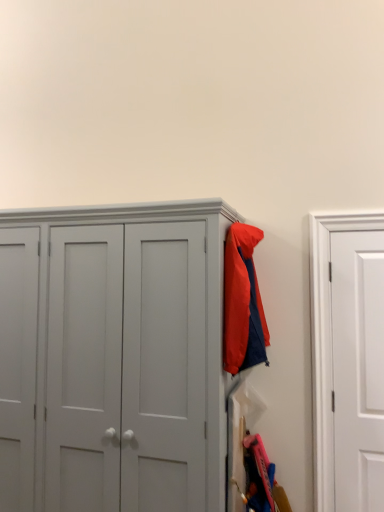
Question: Considering the positions of matte gray cupboard at center and white matte door at right in the image, is matte gray cupboard at center taller or shorter than white matte door at right?

Choices:
 (A) short
 (B) tall

Answer: (B)

Question: Choose the correct answer: Is matte gray cupboard at center inside white matte door at right or outside it?

Choices:
 (A) inside
 (B) outside

Answer: (B)

Question: Considering the real-world distances, which object is farthest from the white matte door at right?

Choices:
 (A) matte nylon jacket at upper right
 (B) matte gray cupboard at center

Answer: (B)

Question: Considering the real-world distances, which object is farthest from the matte nylon jacket at upper right?

Choices:
 (A) matte gray cupboard at center
 (B) white matte door at right

Answer: (B)